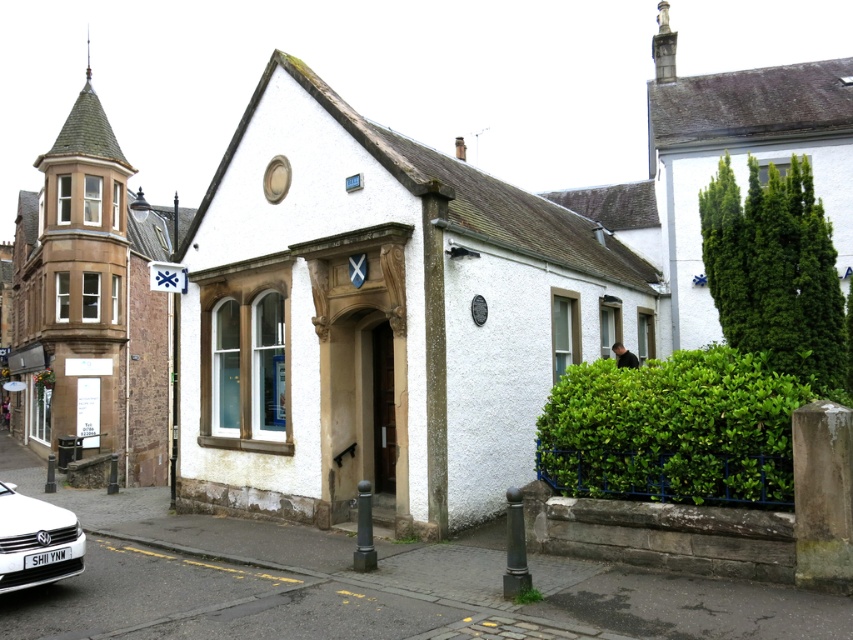
You are a delivery person who needs to park your 3.5 meter long truck between the green leafy bush at right and the white matte car at lower left. Is there enough space?

The green leafy bush at right and the white matte car at lower left are 5.37 meters apart from each other. Since the truck is 3.5 meters long, there is enough space to park between them as 5.37 meters is greater than 3.5 meters.

You are a visitor to this historic town and want to park your car, which is the same size as the white matte car at lower left. There is a space next to the green leafy bush at right. Do you think your car will fit in that space?

The green leafy bush at right has a larger size compared to the white matte car at lower left. Since the space next to the bush is likely sized for the car, your car should fit as it is the same size as the white matte car at lower left.

You are standing in front of the historic building and want to water the green leafy bush at right. If your watering can has a range of 5 meters, can you reach the bush without moving closer?

The green leafy bush at right is 7.65 meters away from the viewer. Since the watering can only reaches 5 meters, you cannot reach the bush without moving closer.